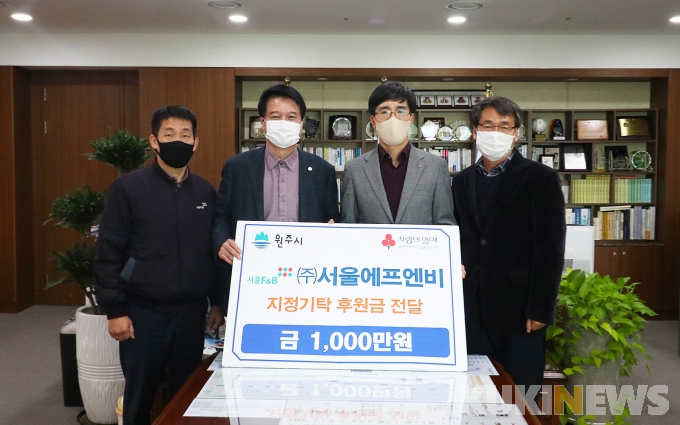
Where is `books`? The height and width of the screenshot is (425, 680). books is located at coordinates click(x=636, y=196).